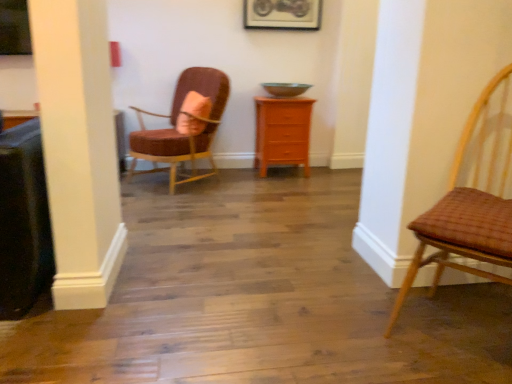
This screenshot has width=512, height=384. Identify the location of free space to the right of velvet pink chair at upper left, the second chair when ordered from front to back. (254, 189).